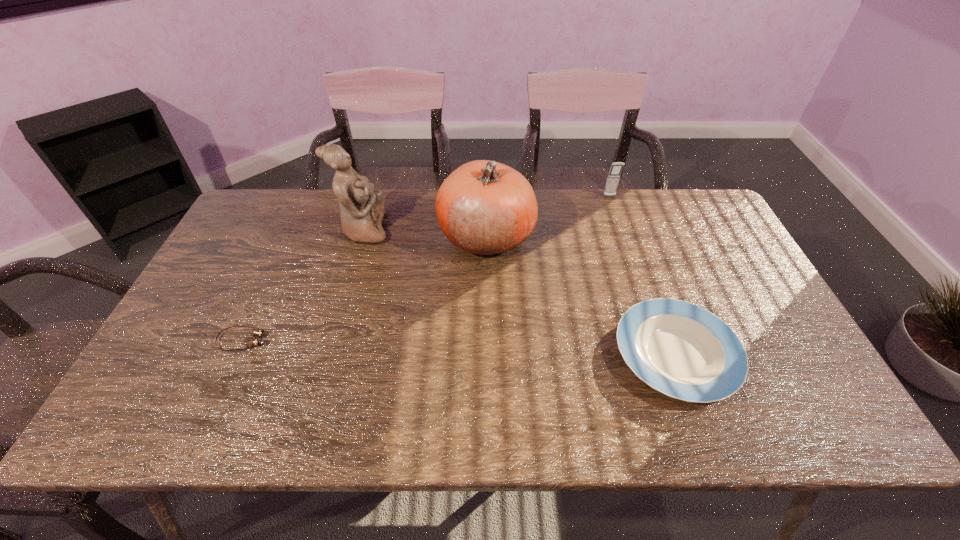
Where is `free point between the fourth tallest object and the pumpkin`? This screenshot has width=960, height=540. free point between the fourth tallest object and the pumpkin is located at coordinates (581, 295).

The image size is (960, 540). Find the location of `unoccupied position between the goggles and the farthest object`. unoccupied position between the goggles and the farthest object is located at coordinates (426, 268).

You are a GUI agent. You are given a task and a screenshot of the screen. Output one action in this format:
    pyautogui.click(x=<x>, y=<y>)
    Task: Click on the free spot between the goggles and the second shortest object
    Image resolution: width=960 pixels, height=540 pixels.
    Given the screenshot: What is the action you would take?
    pyautogui.click(x=460, y=347)

In order to click on unoccupied area between the leftmost object and the plate in this screenshot , I will do `click(460, 347)`.

Locate which object is the fourth closest to the fourth tallest object. Please provide its 2D coordinates. Your answer should be formatted as a tuple, i.e. [(x, y)], where the tuple contains the x and y coordinates of a point satisfying the conditions above.

[(254, 341)]

Identify the location of object that is the second closest to the second object from left to right. (254, 341).

Find the location of a particular element. vacant space that satisfies the following two spatial constraints: 1. on the front-facing side of the fourth object from right to left; 2. on the right side of the plate is located at coordinates (328, 354).

Locate an element on the screen. This screenshot has width=960, height=540. vacant position in the image that satisfies the following two spatial constraints: 1. on the front-facing side of the fourth object from right to left; 2. on the right side of the third object from right to left is located at coordinates (362, 235).

Find the location of a particular element. The width and height of the screenshot is (960, 540). free space that satisfies the following two spatial constraints: 1. on the front-facing side of the cellular telephone; 2. on the front lenses and sides of the shortest object is located at coordinates pos(659,340).

In order to click on free space that satisfies the following two spatial constraints: 1. on the front side of the pumpkin; 2. on the front lenses and sides of the shortest object in this screenshot , I will do `click(488, 340)`.